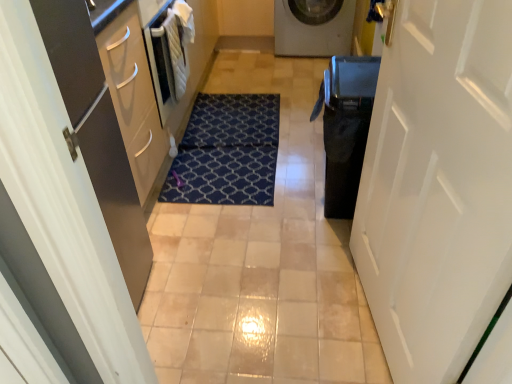
What are the coordinates of `free location in front of black glossy dishwasher at right` in the screenshot? It's located at (315, 246).